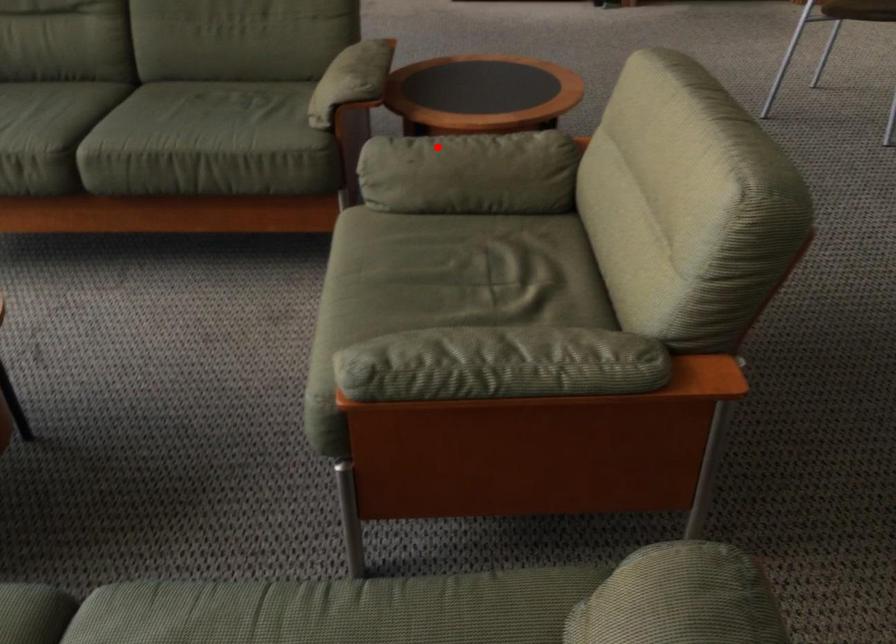
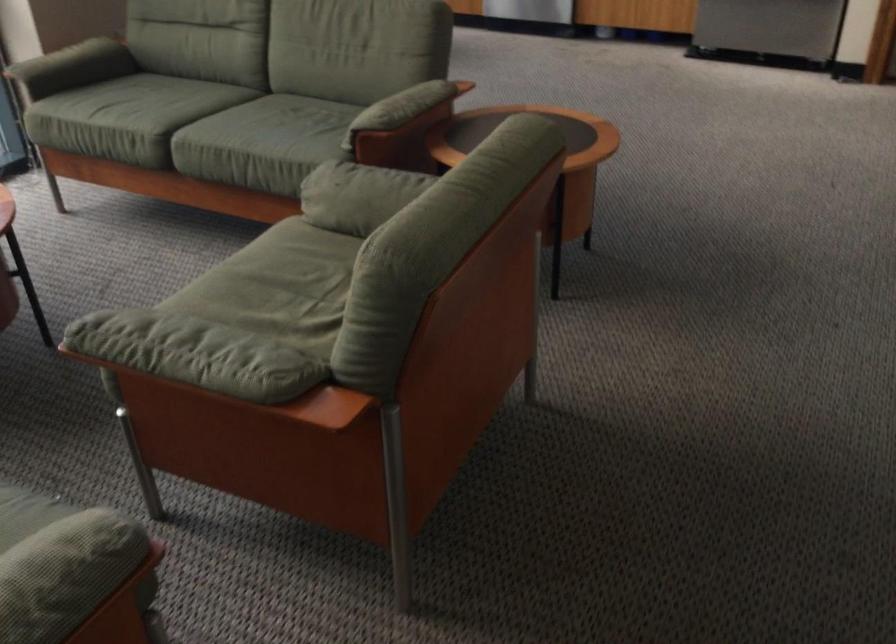
Question: I am providing you with two images of the same scene from different viewpoints. A red point is shown in image1. For the corresponding object point in image2, is it positioned nearer or farther from the camera?

Choices:
 (A) Nearer
 (B) Farther

Answer: (B)